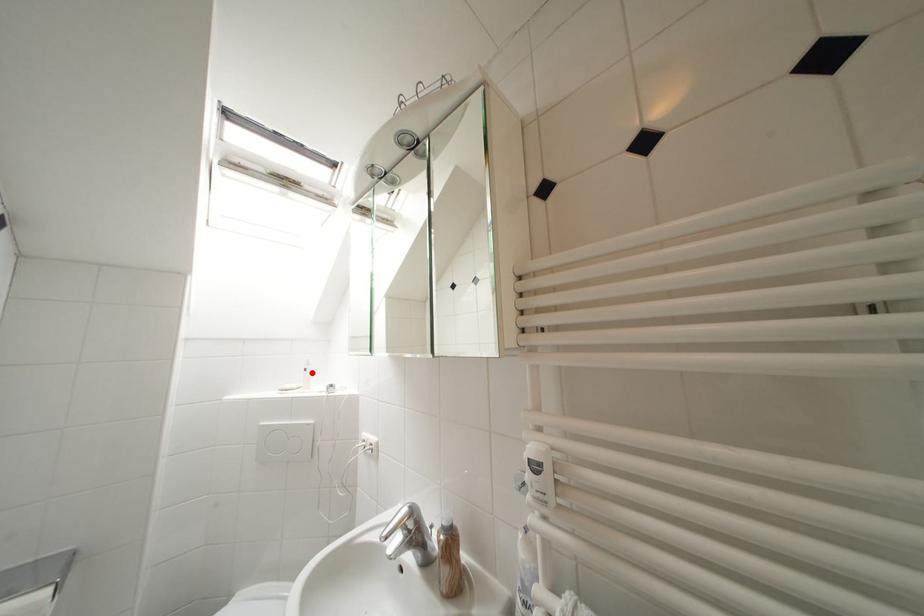
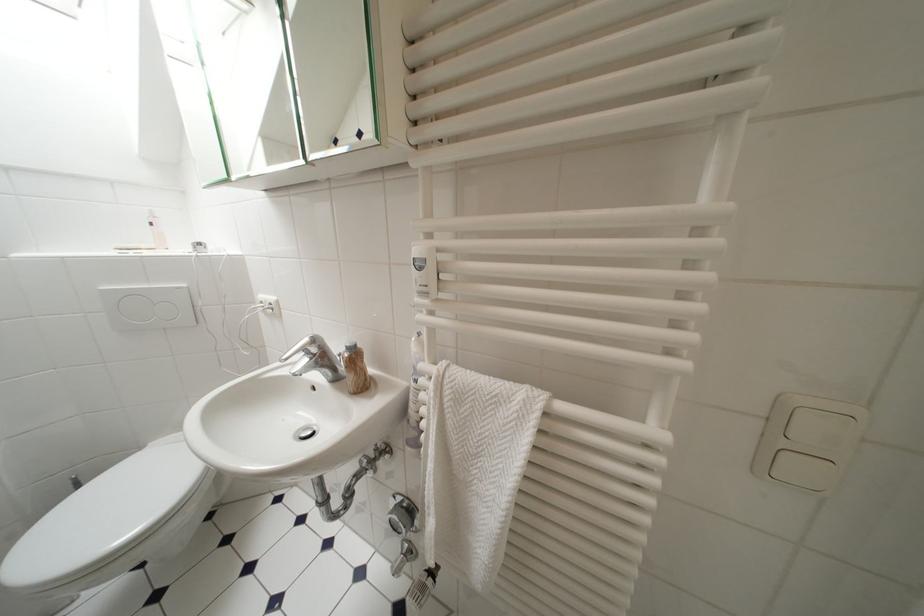
In the second image, find the point that corresponds to the highlighted location in the first image.

(159, 227)